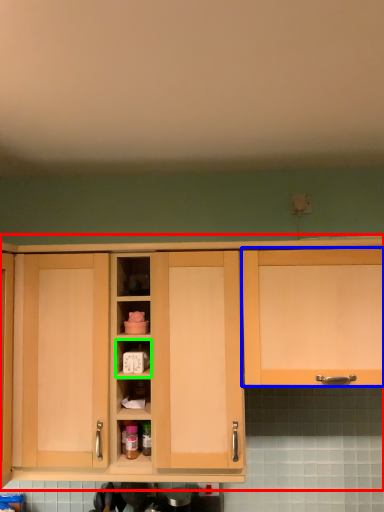
Question: Which is nearer to the cabinetry (highlighted by a red box)? cabinetry (highlighted by a blue box) or cabinet (highlighted by a green box).

Choices:
 (A) cabinetry
 (B) cabinet

Answer: (A)